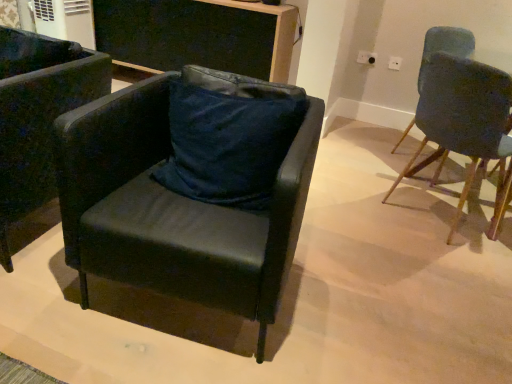
Question: In the image, is white plastic power outlet at upper center, which is the 1th power outlet in left-to-right order, on the left side or the right side of velvet dark blue chair at right, acting as the third chair starting from the left?

Choices:
 (A) left
 (B) right

Answer: (A)

Question: Is point (357, 61) positioned closer to the camera than point (486, 150)?

Choices:
 (A) closer
 (B) farther

Answer: (B)

Question: Based on their relative distances, which object is farther from the black leather chair at center, which is the 2th chair in right-to-left order?

Choices:
 (A) black leather chair at left, which ranks as the first chair in left-to-right order
 (B) black matte desk at upper center
 (C) white plastic power outlet at upper center, which is the 1th power outlet in left-to-right order
 (D) white plastic power outlet at upper right, which appears as the 1th power outlet when viewed from the right
 (E) velvet dark blue chair at right, placed as the 1th chair when sorted from right to left

Answer: (D)

Question: Which object is positioned farthest from the velvet dark blue chair at right, placed as the 1th chair when sorted from right to left?

Choices:
 (A) black leather chair at center, which is the 2th chair in right-to-left order
 (B) white plastic power outlet at upper center, which is the 1th power outlet in left-to-right order
 (C) black matte desk at upper center
 (D) white plastic power outlet at upper right, which appears as the 1th power outlet when viewed from the right
 (E) dark blue fabric pillow at center

Answer: (C)